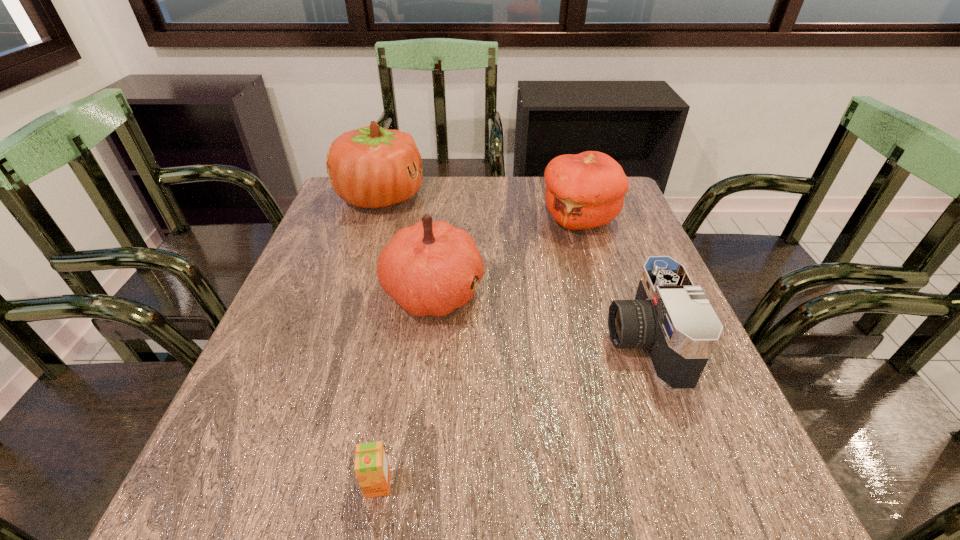
Where is `the nearest pumpkin`? the nearest pumpkin is located at coordinates (428, 268).

The image size is (960, 540). What are the coordinates of `the rightmost pumpkin` in the screenshot? It's located at (586, 190).

The height and width of the screenshot is (540, 960). I want to click on the fourth tallest object, so click(671, 318).

Identify the location of the shortest object. This screenshot has width=960, height=540. (371, 466).

Locate an element on the screen. orange juice is located at coordinates (371, 466).

Where is `vacant space positioned 0.400m on the front-facing side of the nearest pumpkin`? This screenshot has width=960, height=540. vacant space positioned 0.400m on the front-facing side of the nearest pumpkin is located at coordinates (663, 291).

Locate an element on the screen. vacant region located 0.060m on the left of the rightmost pumpkin is located at coordinates (x=518, y=219).

Where is `vacant space situated 0.350m on the front-facing side of the camera`? This screenshot has width=960, height=540. vacant space situated 0.350m on the front-facing side of the camera is located at coordinates (433, 341).

This screenshot has height=540, width=960. What are the coordinates of `vacant space situated 0.310m on the front-facing side of the camera` in the screenshot? It's located at (452, 341).

Image resolution: width=960 pixels, height=540 pixels. Identify the location of vacant space located on the front-facing side of the camera. (447, 341).